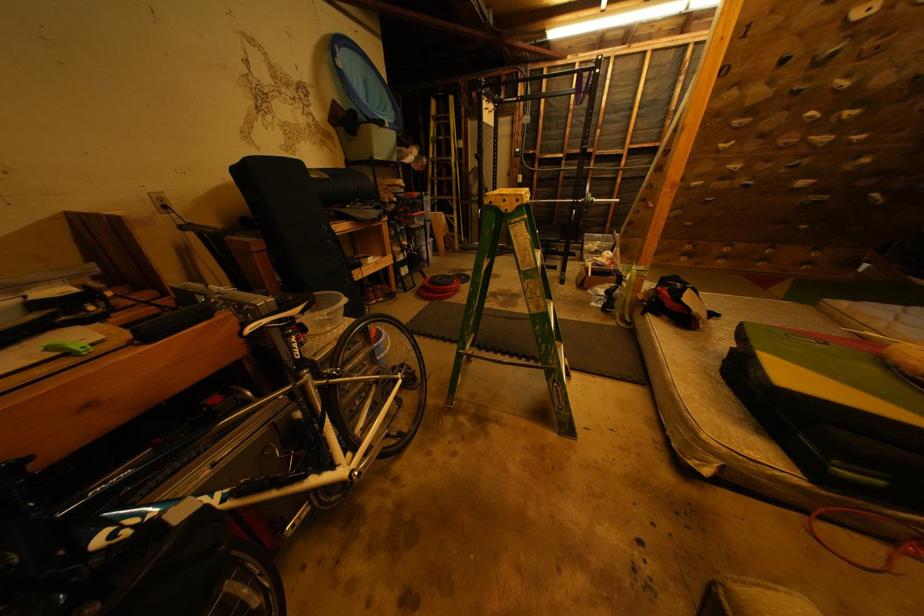
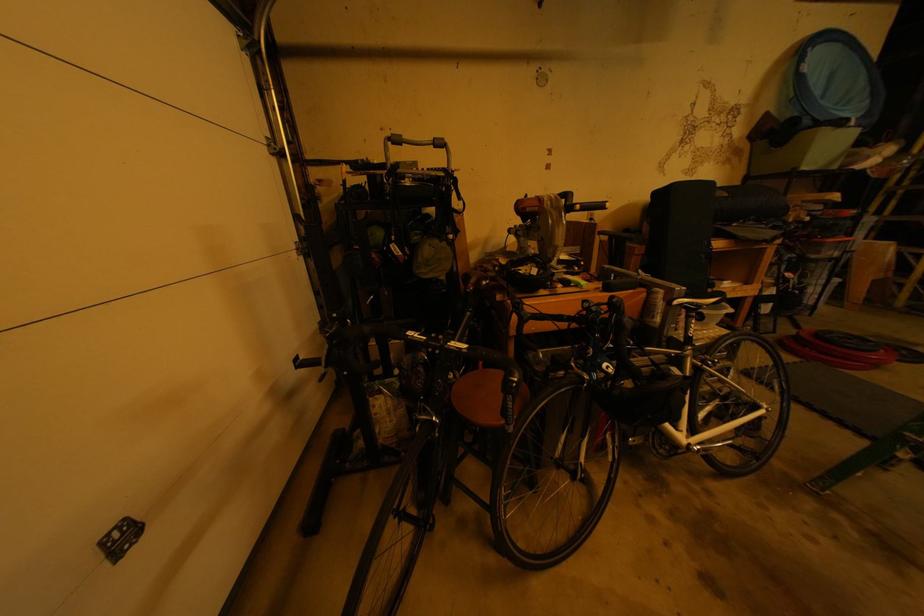
Question: The camera is either moving clockwise (left) or counter-clockwise (right) around the object. The first image is from the beginning of the video and the second image is from the end. Is the camera moving left or right when shooting the video?

Choices:
 (A) Left
 (B) Right

Answer: (B)